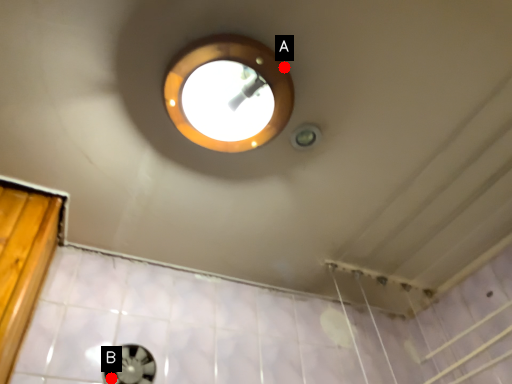
Question: Two points are circled on the image, labeled by A and B beside each circle. Which point is closer to the camera taking this photo?

Choices:
 (A) A is closer
 (B) B is closer

Answer: (A)